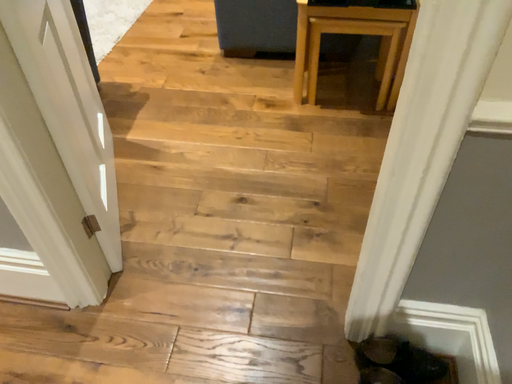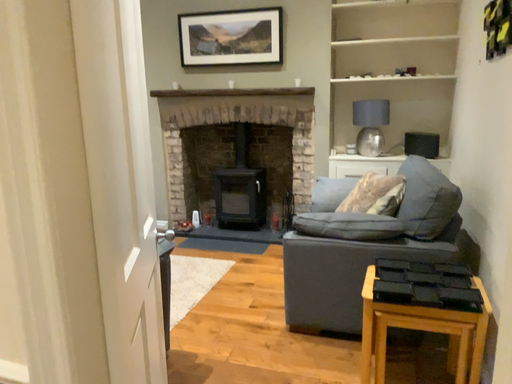
Question: Which way did the camera rotate in the video?

Choices:
 (A) rotated left
 (B) rotated right

Answer: (A)